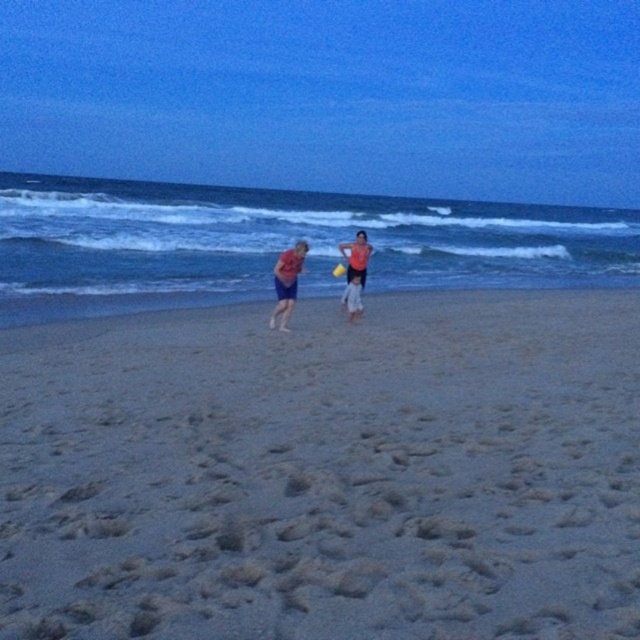
You are a photographer standing on the beach and want to take a photo of the matte blue shorts at center and the yellow plastic frisbee at center. Which object should you focus on first if you want to capture both clearly in your shot?

The matte blue shorts at center is larger in size than the yellow plastic frisbee at center, so you should focus on the matte blue shorts at center first to ensure it is in sharp focus, then adjust for the smaller frisbee.